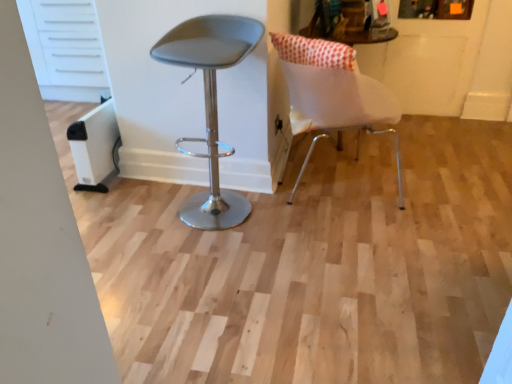
Measure the distance between white fabric cushion at upper right and camera.

The depth of white fabric cushion at upper right is 8.47 feet.

Image resolution: width=512 pixels, height=384 pixels. What do you see at coordinates (349, 35) in the screenshot?
I see `white fabric cushion at upper right` at bounding box center [349, 35].

You are a GUI agent. You are given a task and a screenshot of the screen. Output one action in this format:
    pyautogui.click(x=<x>, y=<y>)
    Task: Click on the white matte chair at right, acting as the 2th chair starting from the left
    
    Given the screenshot: What is the action you would take?
    pyautogui.click(x=335, y=90)

In order to click on white fabric cushion at upper right in this screenshot , I will do `click(349, 35)`.

Which is in front, matte gray stool at center, the second chair from the right, or white fabric cushion at upper right?

matte gray stool at center, the second chair from the right.

Does point (240, 59) come farther from viewer compared to point (345, 39)?

No, (240, 59) is in front of (345, 39).

Could white fabric cushion at upper right be considered to be inside matte gray stool at center, the second chair from the right?

No, white fabric cushion at upper right is not inside matte gray stool at center, the second chair from the right.

How different are the orientations of white fabric cushion at upper right and white matte chair at right, acting as the 2th chair starting from the left, in degrees?

33 degrees separate the facing orientations of white fabric cushion at upper right and white matte chair at right, acting as the 2th chair starting from the left.

Which is more to the right, white fabric cushion at upper right or white matte chair at right, the 1th chair when ordered from right to left?

From the viewer's perspective, white matte chair at right, the 1th chair when ordered from right to left, appears more on the right side.

Considering the relative positions of white fabric cushion at upper right and white matte chair at right, acting as the 2th chair starting from the left, in the image provided, is white fabric cushion at upper right behind white matte chair at right, acting as the 2th chair starting from the left,?

No, the depth of white fabric cushion at upper right is less than that of white matte chair at right, acting as the 2th chair starting from the left.

Is white fabric cushion at upper right placed right next to white matte chair at right, acting as the 2th chair starting from the left?

They are not placed beside each other.

From a real-world perspective, between white fabric cushion at upper right and matte gray stool at center, which is the first chair in left-to-right order, who is vertically lower?

In real-world perspective, matte gray stool at center, which is the first chair in left-to-right order, is lower.

Which object is wider, white fabric cushion at upper right or matte gray stool at center, which is the first chair in left-to-right order?

Wider between the two is white fabric cushion at upper right.

Where is `round table behind the matte gray stool at center, which is the first chair in left-to-right order`? The width and height of the screenshot is (512, 384). round table behind the matte gray stool at center, which is the first chair in left-to-right order is located at coordinates (349, 35).

Find the location of a particular element. chair to the right of matte gray stool at center, the second chair from the right is located at coordinates (335, 90).

Between matte gray stool at center, which is the first chair in left-to-right order, and white matte chair at right, the 1th chair when ordered from right to left, which one has larger size?

white matte chair at right, the 1th chair when ordered from right to left.

Is matte gray stool at center, the second chair from the right, not inside white matte chair at right, acting as the 2th chair starting from the left?

Yes, matte gray stool at center, the second chair from the right, is not within white matte chair at right, acting as the 2th chair starting from the left.

Considering the relative positions of matte gray stool at center, which is the first chair in left-to-right order, and white matte chair at right, the 1th chair when ordered from right to left, in the image provided, is matte gray stool at center, which is the first chair in left-to-right order, behind white matte chair at right, the 1th chair when ordered from right to left,?

No, matte gray stool at center, which is the first chair in left-to-right order, is in front of white matte chair at right, the 1th chair when ordered from right to left.

From the image's perspective, is white matte chair at right, acting as the 2th chair starting from the left, located above matte gray stool at center, the second chair from the right?

Yes, from the image's perspective, white matte chair at right, acting as the 2th chair starting from the left, is on top of matte gray stool at center, the second chair from the right.

Which of these two, white matte chair at right, the 1th chair when ordered from right to left, or matte gray stool at center, the second chair from the right, stands taller?

matte gray stool at center, the second chair from the right.

From a real-world perspective, which object rests below the other?

In real-world perspective, white matte chair at right, the 1th chair when ordered from right to left, is lower.

Measure the distance from white matte chair at right, acting as the 2th chair starting from the left, to matte gray stool at center, the second chair from the right.

white matte chair at right, acting as the 2th chair starting from the left, and matte gray stool at center, the second chair from the right, are 16.48 inches apart.

Is white matte chair at right, acting as the 2th chair starting from the left, wider or thinner than white fabric cushion at upper right?

Considering their sizes, white matte chair at right, acting as the 2th chair starting from the left, looks broader than white fabric cushion at upper right.

Is white matte chair at right, the 1th chair when ordered from right to left, spatially inside white fabric cushion at upper right, or outside of it?

The correct answer is: outside.

Who is bigger, white matte chair at right, acting as the 2th chair starting from the left, or white fabric cushion at upper right?

Bigger between the two is white matte chair at right, acting as the 2th chair starting from the left.

From the image's perspective, which chair is the 2nd one below the white fabric cushion at upper right? Please provide its 2D coordinates.

[(211, 105)]

Where is `round table above the white matte chair at right, acting as the 2th chair starting from the left (from the image's perspective)`? round table above the white matte chair at right, acting as the 2th chair starting from the left (from the image's perspective) is located at coordinates (349, 35).

Looking at the image, which one is located further to white matte chair at right, acting as the 2th chair starting from the left, matte gray stool at center, the second chair from the right, or white fabric cushion at upper right?

Among the two, white fabric cushion at upper right is located further to white matte chair at right, acting as the 2th chair starting from the left.

From the image, which object appears to be farther from white fabric cushion at upper right, matte gray stool at center, which is the first chair in left-to-right order, or white matte chair at right, the 1th chair when ordered from right to left?

matte gray stool at center, which is the first chair in left-to-right order, is positioned further to the anchor white fabric cushion at upper right.

Estimate the real-world distances between objects in this image. Which object is further from white matte chair at right, the 1th chair when ordered from right to left, white fabric cushion at upper right or matte gray stool at center, which is the first chair in left-to-right order?

Among the two, white fabric cushion at upper right is located further to white matte chair at right, the 1th chair when ordered from right to left.

Looking at the image, which one is located closer to matte gray stool at center, the second chair from the right, white matte chair at right, acting as the 2th chair starting from the left, or white fabric cushion at upper right?

white matte chair at right, acting as the 2th chair starting from the left, is closer to matte gray stool at center, the second chair from the right.

Looking at the image, which one is located further to matte gray stool at center, which is the first chair in left-to-right order, white fabric cushion at upper right or white matte chair at right, the 1th chair when ordered from right to left?

white fabric cushion at upper right lies further to matte gray stool at center, which is the first chair in left-to-right order, than the other object.

Based on their spatial positions, is white matte chair at right, the 1th chair when ordered from right to left, or matte gray stool at center, which is the first chair in left-to-right order, closer to white fabric cushion at upper right?

Among the two, white matte chair at right, the 1th chair when ordered from right to left, is located nearer to white fabric cushion at upper right.

The width and height of the screenshot is (512, 384). What are the coordinates of `round table between matte gray stool at center, the second chair from the right, and white matte chair at right, acting as the 2th chair starting from the left` in the screenshot? It's located at (349, 35).